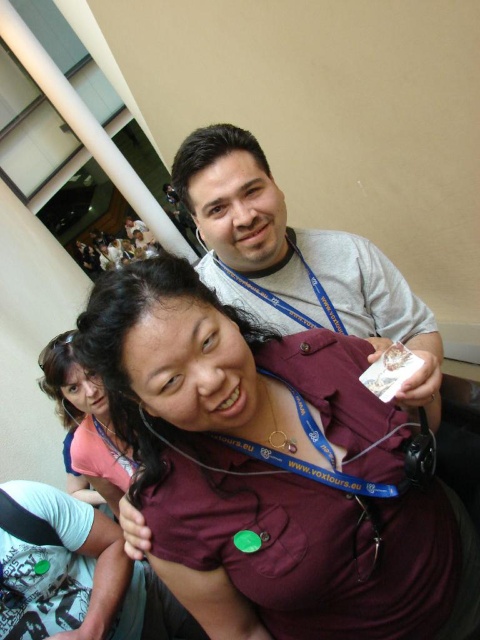
You are at an event and see the maroon fabric shirt at center and the gray fabric neck at upper center. Which one is larger in size?

The maroon fabric shirt at center is bigger than the gray fabric neck at upper center.

You are a photographer trying to capture a clear shot of the gray lanyard at upper center and the camera in the scene. Given that your camera has a depth of field that can focus on objects within a 30 inch range, will both items be in focus?

The gray lanyard at upper center and camera are 34.28 inches apart from each other. Since the distance exceeds the 30 inch range, both items cannot be in focus simultaneously.